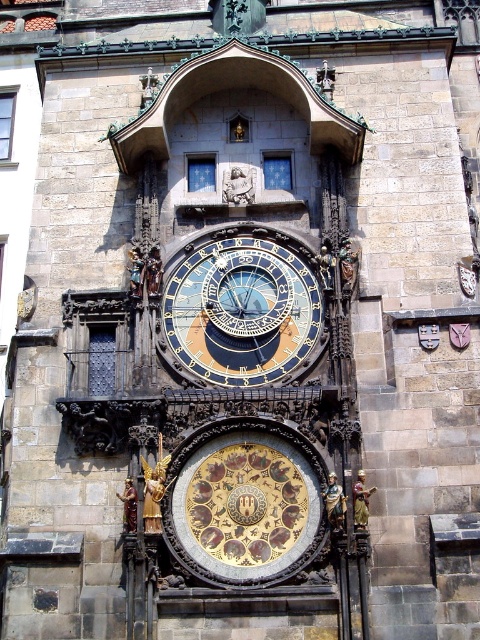
You are standing in front of the Prague Astronomical Clock. There is a point at coordinates (243,502). What object is located at this point?

The gold astrological clock at center is located at point (243,502).